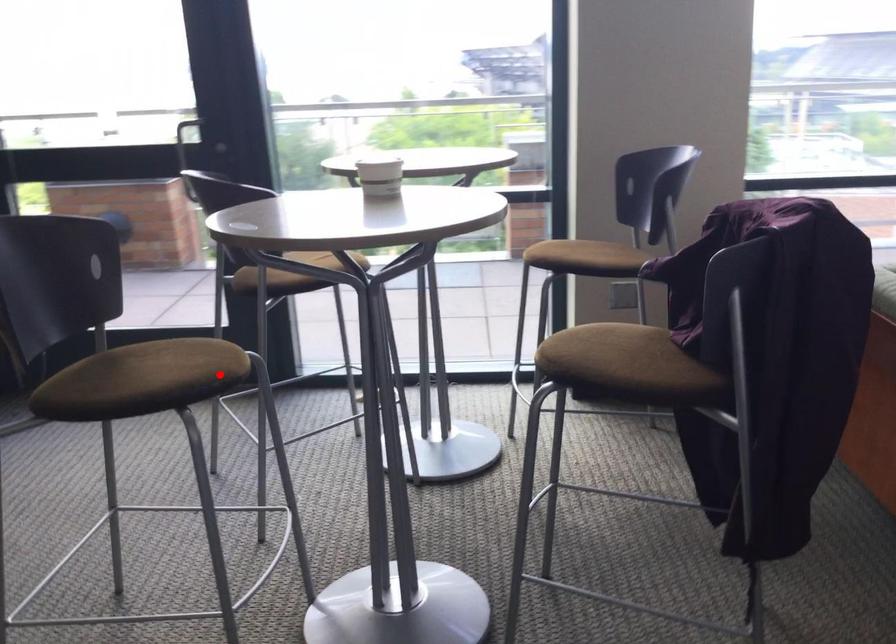
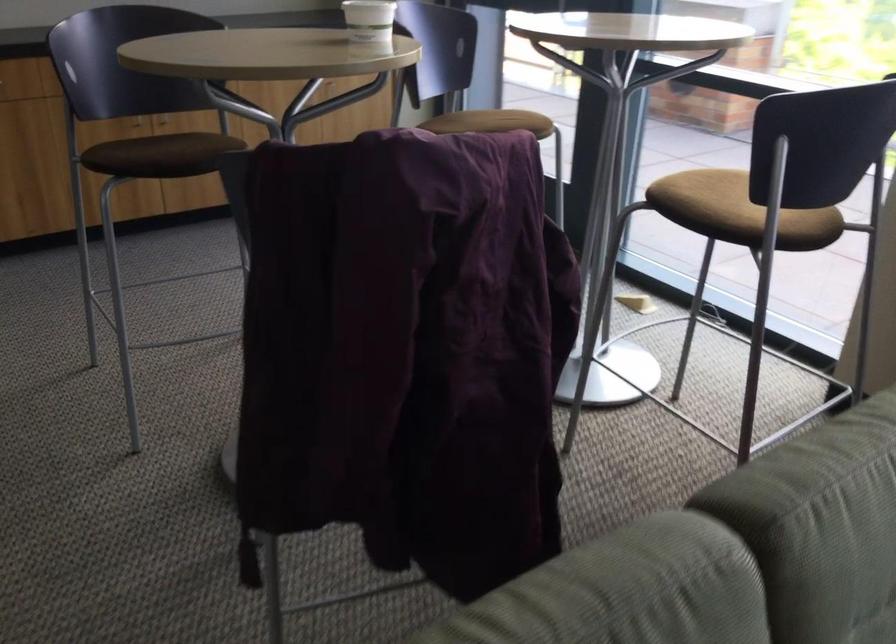
In the second image, find the point that corresponds to the highlighted location in the first image.

(173, 160)